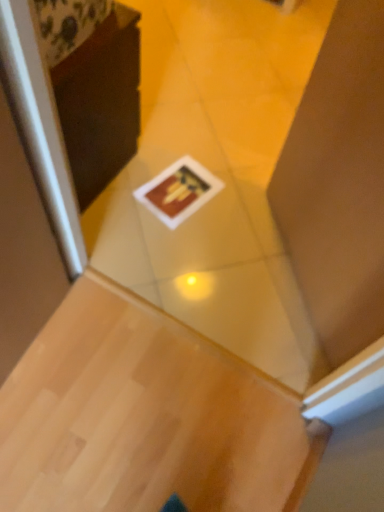
Find the location of a particular element. This screenshot has width=384, height=512. free space to the right of wooden drawer at left is located at coordinates (148, 186).